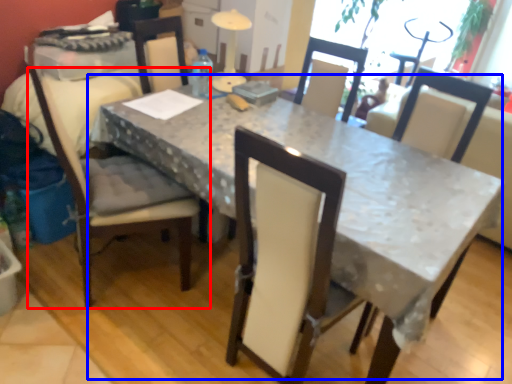
Question: Which point is further to the camera, chair (highlighted by a red box) or table (highlighted by a blue box)?

Choices:
 (A) chair
 (B) table

Answer: (A)